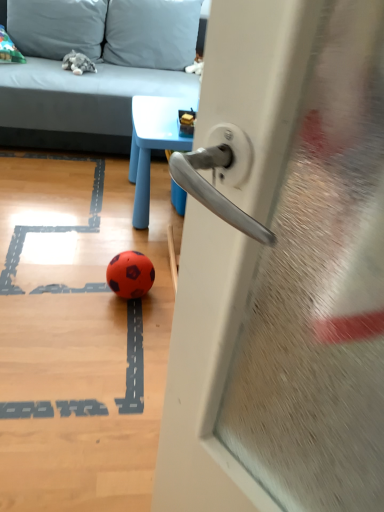
You are a GUI agent. You are given a task and a screenshot of the screen. Output one action in this format:
    pyautogui.click(x=<x>, y=<y>)
    Task: Click on the vacant region to the left of rubber soccer ball at center
    
    Given the screenshot: What is the action you would take?
    pyautogui.click(x=82, y=282)